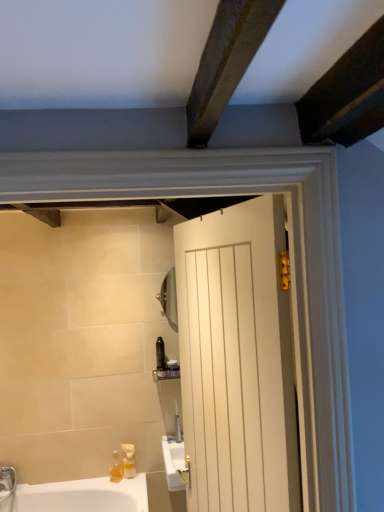
Describe the element at coordinates (160, 354) in the screenshot. I see `translucent plastic bottle at center, positioned as the second toiletry in right-to-left order` at that location.

This screenshot has height=512, width=384. I want to click on white wooden door at center, so click(x=237, y=360).

Measure the distance between point (222, 476) and camera.

They are 1.41 meters apart.

What do you see at coordinates (173, 369) in the screenshot? I see `translucent plastic container at center, the second toiletry positioned from the left` at bounding box center [173, 369].

The image size is (384, 512). I want to click on translucent plastic container at center, the second toiletry positioned from the left, so click(173, 369).

Locate an element on the screen. This screenshot has width=384, height=512. translucent plastic soap dispenser at lower left, acting as the 2th soap dispenser starting from the right is located at coordinates (116, 469).

How much distance is there between translucent plastic soap dispenser at lower left, acting as the 2th soap dispenser starting from the right, and translucent plastic container at center, acting as the 1th toiletry starting from the right?

translucent plastic soap dispenser at lower left, acting as the 2th soap dispenser starting from the right, and translucent plastic container at center, acting as the 1th toiletry starting from the right, are 23.36 inches apart from each other.

From a real-world perspective, is translucent plastic soap dispenser at lower left, acting as the 2th soap dispenser starting from the right, below translucent plastic container at center, acting as the 1th toiletry starting from the right?

Yes, from a real-world perspective, translucent plastic soap dispenser at lower left, acting as the 2th soap dispenser starting from the right, is under translucent plastic container at center, acting as the 1th toiletry starting from the right.

Looking at this image, which object is further away from the camera, translucent plastic soap dispenser at lower left, acting as the 1th soap dispenser starting from the left, or translucent plastic container at center, acting as the 1th toiletry starting from the right?

translucent plastic container at center, acting as the 1th toiletry starting from the right, is more distant.

Considering the relative positions of translucent plastic soap dispenser at lower left, acting as the 1th soap dispenser starting from the left, and translucent plastic container at center, acting as the 1th toiletry starting from the right, in the image provided, is translucent plastic soap dispenser at lower left, acting as the 1th soap dispenser starting from the left, to the left or to the right of translucent plastic container at center, acting as the 1th toiletry starting from the right,?

translucent plastic soap dispenser at lower left, acting as the 1th soap dispenser starting from the left, is positioned on translucent plastic container at center, acting as the 1th toiletry starting from the right,'s left side.

How far apart are white wooden door at center and translucent plastic soap dispenser at lower left, acting as the 2th soap dispenser starting from the right?

white wooden door at center and translucent plastic soap dispenser at lower left, acting as the 2th soap dispenser starting from the right, are 4.97 feet apart.

Between white wooden door at center and translucent plastic soap dispenser at lower left, acting as the 2th soap dispenser starting from the right, which one appears on the right side from the viewer's perspective?

white wooden door at center.

Which of these two, white wooden door at center or translucent plastic soap dispenser at lower left, acting as the 1th soap dispenser starting from the left, stands taller?

white wooden door at center.

From the image's perspective, is white wooden door at center located beneath translucent plastic soap dispenser at lower left, acting as the 2th soap dispenser starting from the right?

Actually, white wooden door at center appears above translucent plastic soap dispenser at lower left, acting as the 2th soap dispenser starting from the right, in the image.

Which is more to the right, translucent plastic bottle at center, the 1th toiletry positioned from the left, or translucent plastic soap dispenser at lower left, acting as the 2th soap dispenser starting from the right?

From the viewer's perspective, translucent plastic bottle at center, the 1th toiletry positioned from the left, appears more on the right side.

Is translucent plastic bottle at center, positioned as the second toiletry in right-to-left order, smaller than translucent plastic soap dispenser at lower left, acting as the 2th soap dispenser starting from the right?

No.

Based on the photo, from the image's perspective, which is below, translucent plastic bottle at center, positioned as the second toiletry in right-to-left order, or translucent plastic soap dispenser at lower left, acting as the 2th soap dispenser starting from the right?

From the image's view, translucent plastic soap dispenser at lower left, acting as the 2th soap dispenser starting from the right, is below.

Considering their positions, is translucent plastic bottle at center, the 1th toiletry positioned from the left, located in front of or behind translucent plastic soap dispenser at lower left, acting as the 1th soap dispenser starting from the left?

In the image, translucent plastic bottle at center, the 1th toiletry positioned from the left, appears behind translucent plastic soap dispenser at lower left, acting as the 1th soap dispenser starting from the left.

Is white wooden door at center at the back of translucent plastic bottle at center, positioned as the second toiletry in right-to-left order?

No.

From the image's perspective, which one is positioned higher, translucent plastic bottle at center, positioned as the second toiletry in right-to-left order, or white wooden door at center?

white wooden door at center is shown above in the image.

Measure the distance from translucent plastic bottle at center, the 1th toiletry positioned from the left, to white wooden door at center.

translucent plastic bottle at center, the 1th toiletry positioned from the left, and white wooden door at center are 4.22 feet apart from each other.

From a real-world perspective, is translucent plastic bottle at center, positioned as the second toiletry in right-to-left order, positioned above or below white wooden door at center?

translucent plastic bottle at center, positioned as the second toiletry in right-to-left order, is situated lower than white wooden door at center in the real world.

Is point (169, 362) closer or farther from the camera than point (119, 481)?

Point (169, 362).

How different are the orientations of translucent plastic container at center, acting as the 1th toiletry starting from the right, and translucent plastic soap dispenser at lower left, acting as the 1th soap dispenser starting from the left, in degrees?

The angle between the facing direction of translucent plastic container at center, acting as the 1th toiletry starting from the right, and the facing direction of translucent plastic soap dispenser at lower left, acting as the 1th soap dispenser starting from the left, is 30.5 degrees.

Which object is further away from the camera, translucent plastic container at center, acting as the 1th toiletry starting from the right, or translucent plastic soap dispenser at lower left, acting as the 2th soap dispenser starting from the right?

translucent plastic container at center, acting as the 1th toiletry starting from the right, is further away from the camera.

Which of these two, translucent plastic container at center, acting as the 1th toiletry starting from the right, or translucent plastic soap dispenser at lower left, acting as the 1th soap dispenser starting from the left, stands taller?

translucent plastic soap dispenser at lower left, acting as the 1th soap dispenser starting from the left, is taller.

Is translucent plastic soap dispenser at lower left, acting as the 2th soap dispenser starting from the right, closer to the viewer compared to translucent yellow plastic at lower left, placed as the 1th soap dispenser when sorted from right to left?

Yes, it is.

From the image's perspective, relative to translucent yellow plastic at lower left, positioned as the 2th soap dispenser in left-to-right order, is translucent plastic soap dispenser at lower left, acting as the 2th soap dispenser starting from the right, above or below?

translucent plastic soap dispenser at lower left, acting as the 2th soap dispenser starting from the right, is below translucent yellow plastic at lower left, positioned as the 2th soap dispenser in left-to-right order.

The height and width of the screenshot is (512, 384). Identify the location of soap dispenser on the right side of translucent plastic soap dispenser at lower left, acting as the 2th soap dispenser starting from the right. (129, 461).

How many degrees apart are the facing directions of translucent plastic soap dispenser at lower left, acting as the 2th soap dispenser starting from the right, and translucent yellow plastic at lower left, positioned as the 2th soap dispenser in left-to-right order?

The angular difference between translucent plastic soap dispenser at lower left, acting as the 2th soap dispenser starting from the right, and translucent yellow plastic at lower left, positioned as the 2th soap dispenser in left-to-right order, is 19.8 degrees.

Is translucent plastic container at center, acting as the 1th toiletry starting from the right, positioned with its back to translucent plastic bottle at center, the 1th toiletry positioned from the left?

No.

From a real-world perspective, is translucent plastic container at center, the second toiletry positioned from the left, below translucent plastic bottle at center, the 1th toiletry positioned from the left?

Correct, in the physical world, translucent plastic container at center, the second toiletry positioned from the left, is lower than translucent plastic bottle at center, the 1th toiletry positioned from the left.

Locate an element on the screen. toiletry on the right of translucent plastic bottle at center, positioned as the second toiletry in right-to-left order is located at coordinates (173, 369).

In terms of width, does translucent plastic container at center, acting as the 1th toiletry starting from the right, look wider or thinner when compared to translucent plastic bottle at center, positioned as the second toiletry in right-to-left order?

Considering their sizes, translucent plastic container at center, acting as the 1th toiletry starting from the right, looks slimmer than translucent plastic bottle at center, positioned as the second toiletry in right-to-left order.

The width and height of the screenshot is (384, 512). Identify the location of the 2nd soap dispenser positioned below the translucent plastic container at center, the second toiletry positioned from the left (from a real-world perspective). (116, 469).

You are a GUI agent. You are given a task and a screenshot of the screen. Output one action in this format:
    pyautogui.click(x=<x>, y=<y>)
    Task: Click on the door above the translucent plastic soap dispenser at lower left, acting as the 1th soap dispenser starting from the left (from a real-world perspective)
    Image resolution: width=384 pixels, height=512 pixels.
    Given the screenshot: What is the action you would take?
    [x=237, y=360]

When comparing their distances from white wooden door at center, does translucent yellow plastic at lower left, placed as the 1th soap dispenser when sorted from right to left, or translucent plastic bottle at center, the 1th toiletry positioned from the left, seem further?

Based on the image, translucent yellow plastic at lower left, placed as the 1th soap dispenser when sorted from right to left, appears to be further to white wooden door at center.

Looking at the image, which one is located further to translucent plastic container at center, the second toiletry positioned from the left, translucent plastic soap dispenser at lower left, acting as the 2th soap dispenser starting from the right, or translucent plastic bottle at center, positioned as the second toiletry in right-to-left order?

Based on the image, translucent plastic soap dispenser at lower left, acting as the 2th soap dispenser starting from the right, appears to be further to translucent plastic container at center, the second toiletry positioned from the left.

When comparing their distances from translucent plastic container at center, acting as the 1th toiletry starting from the right, does translucent yellow plastic at lower left, positioned as the 2th soap dispenser in left-to-right order, or white wooden door at center seem further?

Among the two, white wooden door at center is located further to translucent plastic container at center, acting as the 1th toiletry starting from the right.

Which object lies nearer to the anchor point translucent plastic soap dispenser at lower left, acting as the 1th soap dispenser starting from the left, translucent yellow plastic at lower left, positioned as the 2th soap dispenser in left-to-right order, or translucent plastic container at center, acting as the 1th toiletry starting from the right?

The object closer to translucent plastic soap dispenser at lower left, acting as the 1th soap dispenser starting from the left, is translucent yellow plastic at lower left, positioned as the 2th soap dispenser in left-to-right order.

Based on their spatial positions, is translucent plastic container at center, the second toiletry positioned from the left, or translucent plastic soap dispenser at lower left, acting as the 2th soap dispenser starting from the right, further from white wooden door at center?

Based on the image, translucent plastic soap dispenser at lower left, acting as the 2th soap dispenser starting from the right, appears to be further to white wooden door at center.

Looking at the image, which one is located closer to white wooden door at center, translucent yellow plastic at lower left, placed as the 1th soap dispenser when sorted from right to left, or translucent plastic soap dispenser at lower left, acting as the 1th soap dispenser starting from the left?

translucent yellow plastic at lower left, placed as the 1th soap dispenser when sorted from right to left, lies closer to white wooden door at center than the other object.

Based on the photo, estimate the real-world distances between objects in this image. Which object is further from translucent plastic container at center, the second toiletry positioned from the left, translucent plastic bottle at center, the 1th toiletry positioned from the left, or translucent yellow plastic at lower left, placed as the 1th soap dispenser when sorted from right to left?

translucent yellow plastic at lower left, placed as the 1th soap dispenser when sorted from right to left.

Based on their spatial positions, is translucent plastic container at center, acting as the 1th toiletry starting from the right, or white wooden door at center further from translucent plastic bottle at center, positioned as the second toiletry in right-to-left order?

white wooden door at center lies further to translucent plastic bottle at center, positioned as the second toiletry in right-to-left order, than the other object.

Locate an element on the screen. toiletry between translucent plastic bottle at center, positioned as the second toiletry in right-to-left order, and translucent yellow plastic at lower left, placed as the 1th soap dispenser when sorted from right to left, in the vertical direction is located at coordinates coord(173,369).

This screenshot has height=512, width=384. I want to click on toiletry between translucent plastic bottle at center, positioned as the second toiletry in right-to-left order, and translucent plastic soap dispenser at lower left, acting as the 1th soap dispenser starting from the left, in the up-down direction, so click(x=173, y=369).

The image size is (384, 512). Identify the location of soap dispenser between translucent plastic bottle at center, positioned as the second toiletry in right-to-left order, and translucent plastic soap dispenser at lower left, acting as the 2th soap dispenser starting from the right, from top to bottom. (129, 461).

Identify the location of soap dispenser located between white wooden door at center and translucent yellow plastic at lower left, placed as the 1th soap dispenser when sorted from right to left, in the depth direction. The height and width of the screenshot is (512, 384). (116, 469).